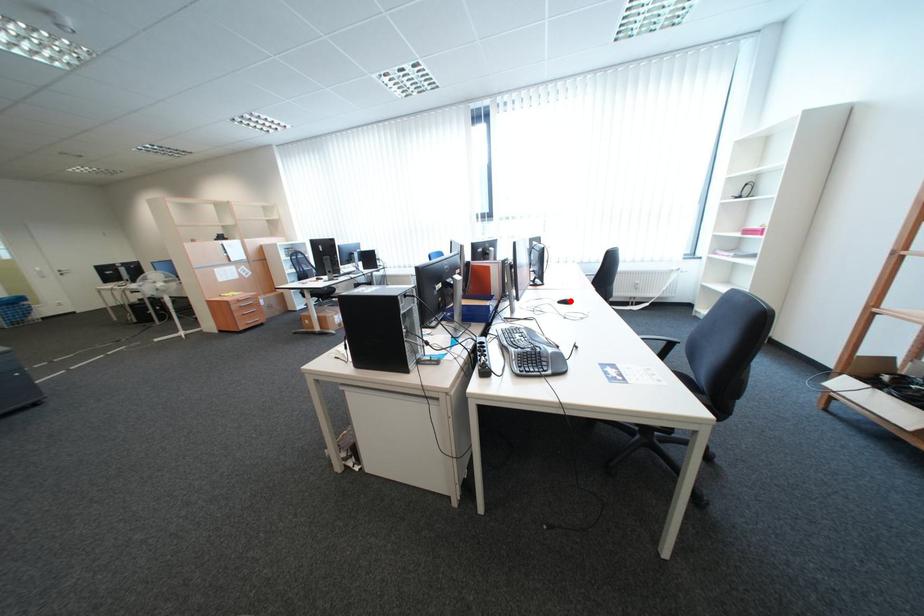
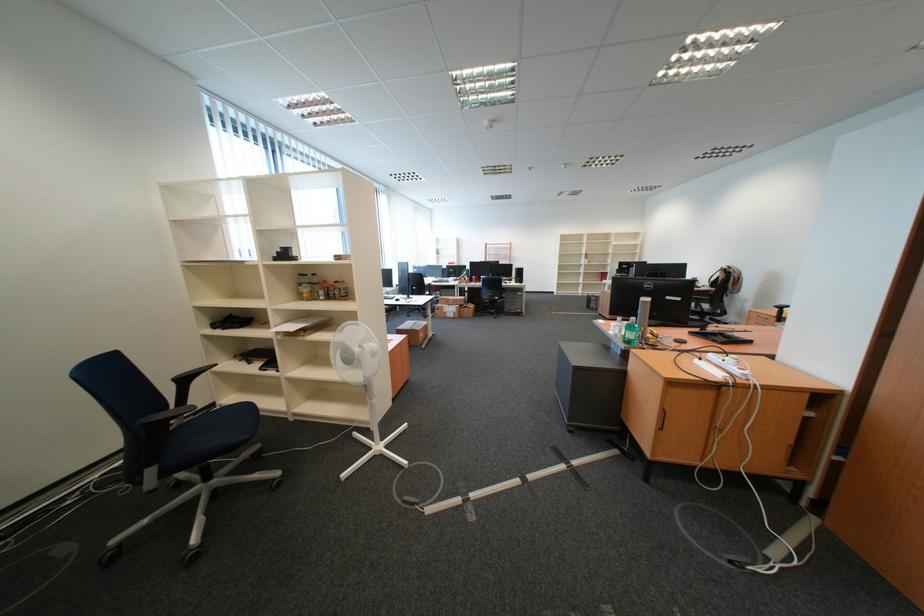
Question: I am providing you with two images of the same scene from different viewpoints. A red point is marked on the first image. Can you still see the location of the red point in image 2?

Choices:
 (A) Yes
 (B) No

Answer: (B)